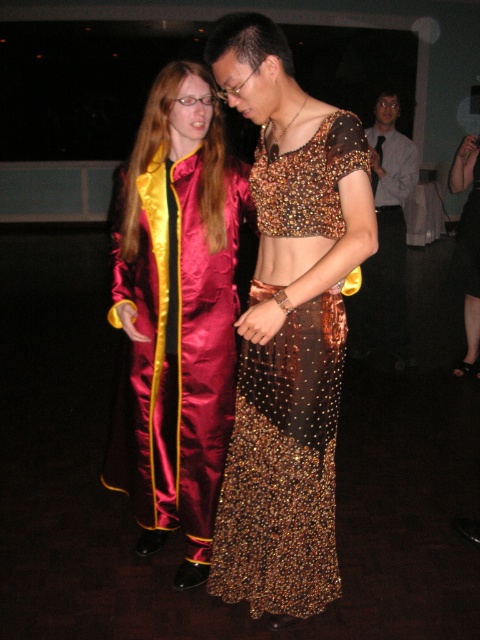
Question: Estimate the real-world distances between objects in this image. Which object is closer to the shiny satin suit at center?

Choices:
 (A) gold sequined dress at center
 (B) shiny gold shirt at center

Answer: (B)

Question: Can you confirm if satin/jacquard robe at center is positioned to the right of shiny satin robe at center?

Choices:
 (A) yes
 (B) no

Answer: (B)

Question: Can you confirm if satin/jacquard robe at center is positioned to the right of shiny gold shirt at center?

Choices:
 (A) no
 (B) yes

Answer: (A)

Question: Among these points, which one is farthest from the camera?

Choices:
 (A) (478, 173)
 (B) (475, 212)

Answer: (A)

Question: Based on their relative distances, which object is nearer to the gold sequined dress at center?

Choices:
 (A) shiny satin robe at center
 (B) shiny satin suit at center
 (C) beaded sheer skirt at center
 (D) shiny gold shirt at center

Answer: (A)

Question: Is beaded sheer skirt at center positioned at the back of gold sequined dress at center?

Choices:
 (A) yes
 (B) no

Answer: (B)